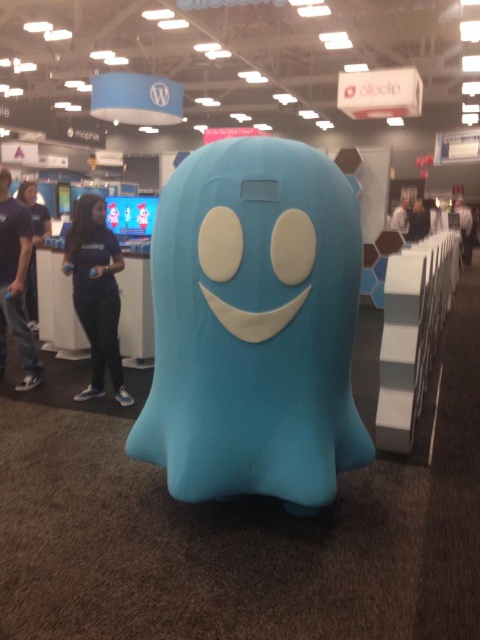
Question: From the image, what is the correct spatial relationship of matte black shirt at left in relation to matte blue face at center?

Choices:
 (A) right
 (B) left

Answer: (B)

Question: Which object is closer to the camera taking this photo?

Choices:
 (A) matte blue plush ghost at center
 (B) matte black face at left

Answer: (A)

Question: Does matte blue plush ghost at center have a smaller size compared to blue matte shirt at left?

Choices:
 (A) no
 (B) yes

Answer: (A)

Question: Can you confirm if blue matte shirt at left is smaller than dark blue fabric jacket at center?

Choices:
 (A) no
 (B) yes

Answer: (B)

Question: Which object appears farthest from the camera in this image?

Choices:
 (A) blue matte plush toy at left
 (B) matte black face at left

Answer: (B)

Question: Based on their relative distances, which object is farther from the matte black shirt at left?

Choices:
 (A) dark gray fabric jacket at center
 (B) blue matte plush toy at left
 (C) dark blue fabric jacket at center
 (D) blue matte shirt at left

Answer: (A)